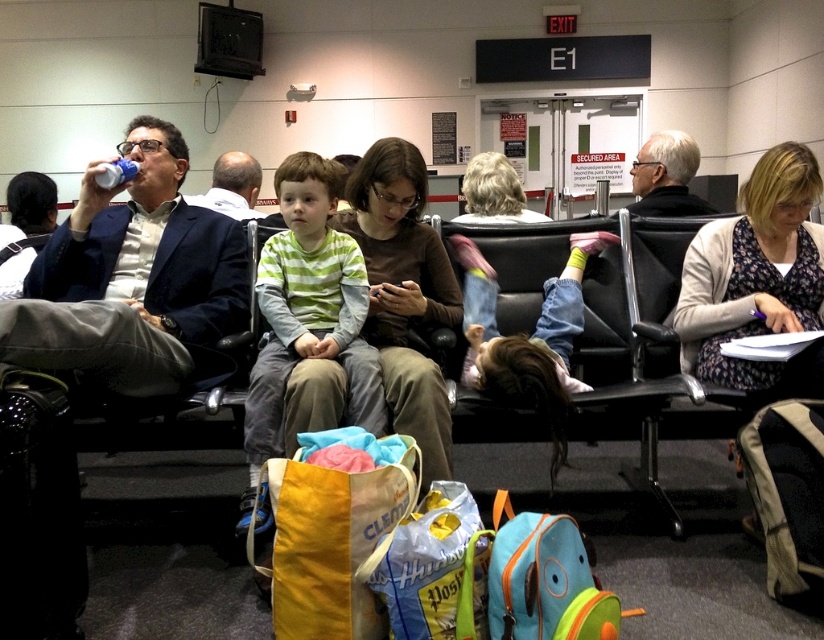
You are standing in the airport waiting area and want to reach the point marked at coordinates (574, 436). The distance you can move forward is limited to 8 feet. Can you safely reach that point without exceeding your movement limit?

The point at coordinates (574, 436) is 8.53 feet away from the viewer, which exceeds the 8 feet movement limit. Therefore, you cannot safely reach that point without exceeding your movement limit.

You are an airport security agent checking the size of clothing items. You see a green striped shirt at center and denim jeans at center. Which clothing item is larger in size?

The green striped shirt at center is bigger than the denim jeans at center.